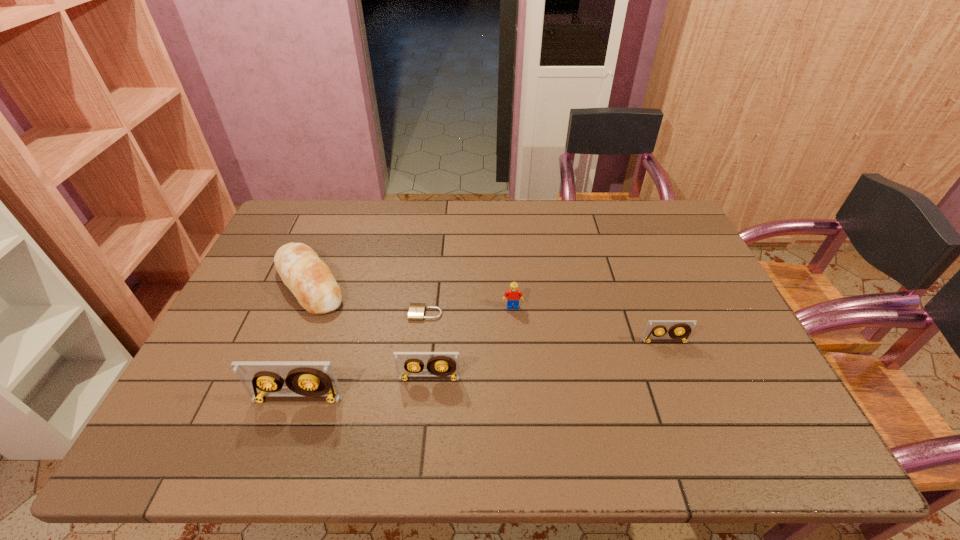
Find the location of a particular element. Image resolution: width=960 pixels, height=540 pixels. free space located on the back of the bread is located at coordinates (344, 200).

The image size is (960, 540). In order to click on vacant region located on the face of the Lego in this screenshot , I will do `click(514, 323)`.

Where is `vacant region located 0.120m on the left of the padlock`? This screenshot has width=960, height=540. vacant region located 0.120m on the left of the padlock is located at coordinates (366, 313).

Locate an element on the screen. This screenshot has width=960, height=540. object positioned at the left edge is located at coordinates (310, 280).

The width and height of the screenshot is (960, 540). I want to click on object present at the right edge, so click(x=679, y=329).

Identify the location of vacant space at the far edge of the desktop. This screenshot has height=540, width=960. (510, 202).

In the image, there is a desktop. Identify the location of vacant space at the near edge. (475, 401).

Locate an element on the screen. The image size is (960, 540). vacant space at the right edge of the desktop is located at coordinates (726, 316).

This screenshot has height=540, width=960. In the image, there is a desktop. Identify the location of free space at the far right corner. (661, 207).

Identify the location of blank space at the near right corner of the desktop. This screenshot has width=960, height=540. (738, 381).